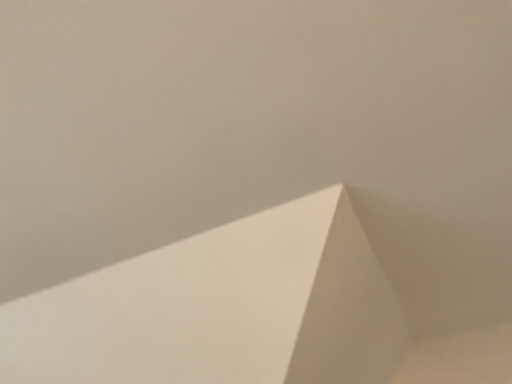
Measure the distance between white matte triangle at center and camera.

white matte triangle at center and camera are 3.52 feet apart from each other.

The width and height of the screenshot is (512, 384). Describe the element at coordinates (243, 314) in the screenshot. I see `white matte triangle at center` at that location.

Identify the location of white matte triangle at center. The image size is (512, 384). (243, 314).

At what (x,y) coordinates should I click in order to perform the action: click on white matte triangle at center. Please return your answer as a coordinate pair (x, y). Looking at the image, I should click on (243, 314).